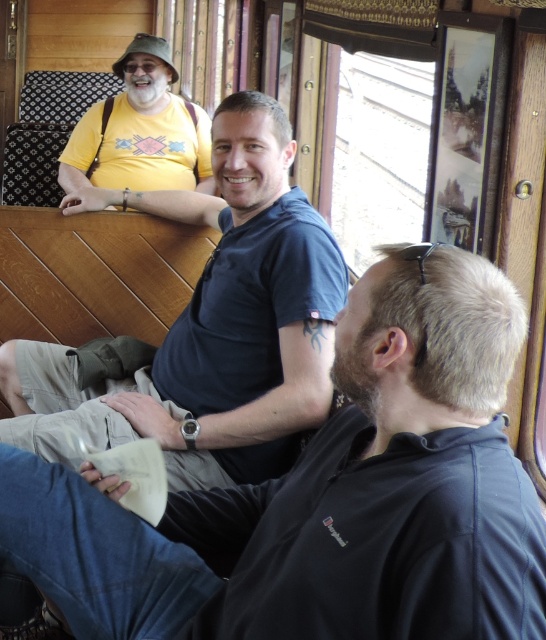
You are a photographer standing in front of the black matte shirt at center. You want to take a clear photo of the person wearing it without any blur. Considering your camera has a focus range of 1.5 to 2 meters, will you be able to capture a sharp image?

The black matte shirt at center is 1.77 meters from the camera. Since the focus range of 1.5 to 2 meters includes this distance, the camera can capture a sharp image of the person wearing the black matte shirt at center.

You are a photographer taking a picture of the two people in the vintage train car. You notice the black matte shirt at center and the blue cotton shirt at center. Which shirt is closer to the camera?

The blue cotton shirt at center is closer to the camera because the black matte shirt at center is positioned under it.